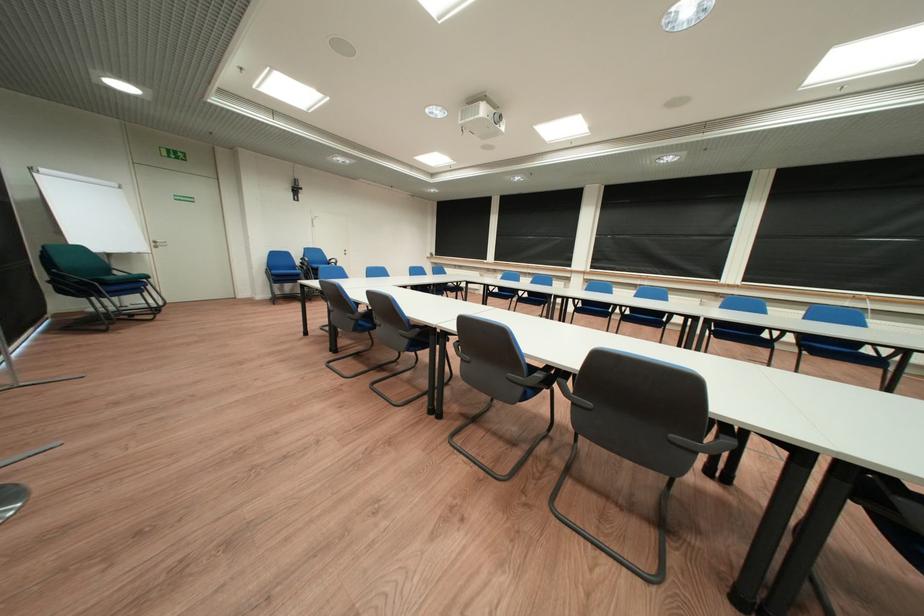
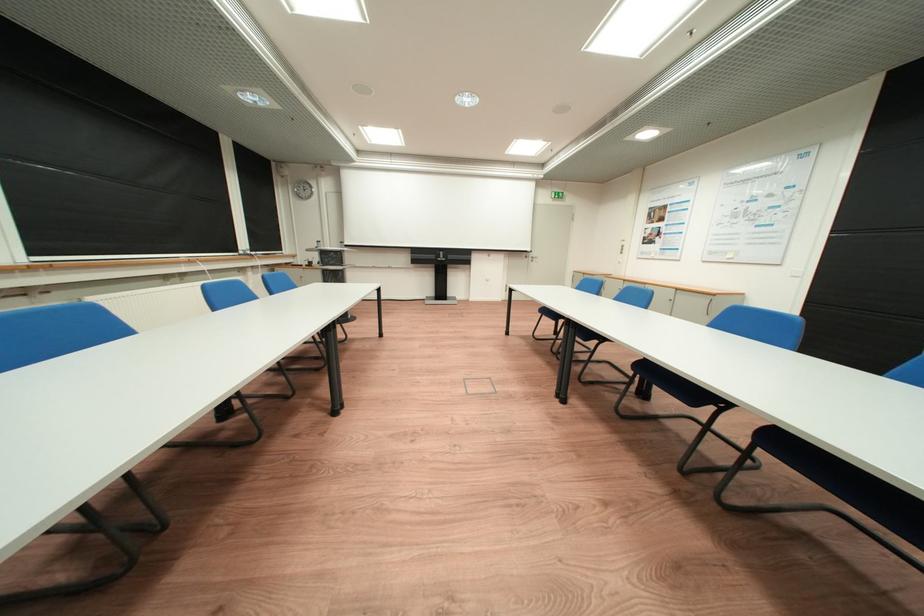
Question: I am providing you with two images of the same scene from different viewpoints. Which of the following objects are not visible in image2?

Choices:
 (A) cabinet handle
 (B) door handle
 (C) blue chair sitting surface
 (D) dark striped towel

Answer: (C)